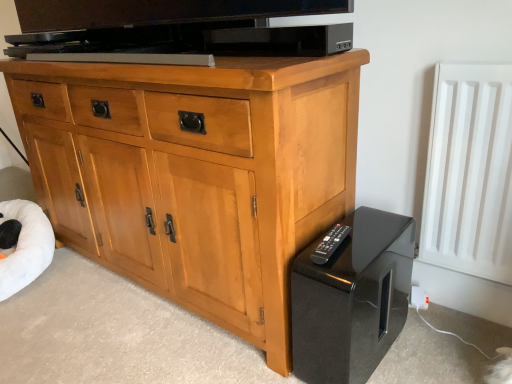
Question: Does black plastic remote at lower right have a lesser height compared to white plush bean bag at lower left?

Choices:
 (A) yes
 (B) no

Answer: (A)

Question: Can you confirm if black plastic remote at lower right is thinner than white plush bean bag at lower left?

Choices:
 (A) yes
 (B) no

Answer: (A)

Question: From the image's perspective, is black plastic remote at lower right over white plush bean bag at lower left?

Choices:
 (A) no
 (B) yes

Answer: (B)

Question: Is black plastic remote at lower right surrounding white plush bean bag at lower left?

Choices:
 (A) yes
 (B) no

Answer: (B)

Question: Does black plastic remote at lower right come behind white plush bean bag at lower left?

Choices:
 (A) no
 (B) yes

Answer: (A)

Question: Are black plastic remote at lower right and white plush bean bag at lower left making contact?

Choices:
 (A) yes
 (B) no

Answer: (B)

Question: From a real-world perspective, is light wood cabinet at center below white plush bean bag at lower left?

Choices:
 (A) yes
 (B) no

Answer: (B)

Question: Considering the relative sizes of light wood cabinet at center and white plush bean bag at lower left in the image provided, is light wood cabinet at center thinner than white plush bean bag at lower left?

Choices:
 (A) yes
 (B) no

Answer: (A)

Question: Can you confirm if light wood cabinet at center is bigger than white plush bean bag at lower left?

Choices:
 (A) yes
 (B) no

Answer: (A)

Question: Is light wood cabinet at center not inside white plush bean bag at lower left?

Choices:
 (A) no
 (B) yes

Answer: (B)

Question: Considering the relative positions of light wood cabinet at center and white plush bean bag at lower left in the image provided, is light wood cabinet at center to the left of white plush bean bag at lower left from the viewer's perspective?

Choices:
 (A) no
 (B) yes

Answer: (A)

Question: Is light wood cabinet at center positioned with its back to white plush bean bag at lower left?

Choices:
 (A) yes
 (B) no

Answer: (B)

Question: From the image's perspective, is white matte radiator at right located beneath black glossy speaker at lower right?

Choices:
 (A) yes
 (B) no

Answer: (B)